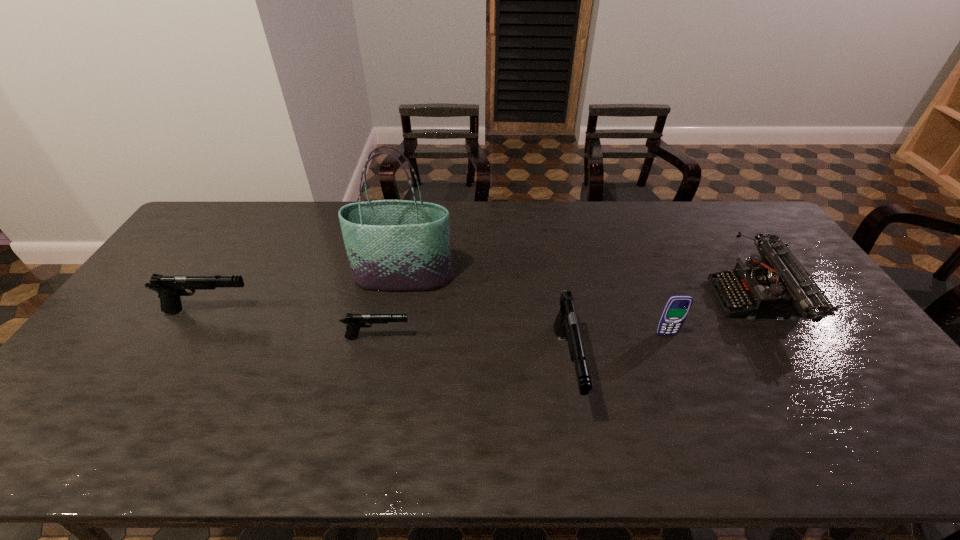
The height and width of the screenshot is (540, 960). Identify the location of vacant space in between the tote bag and the rightmost gun. (485, 322).

Image resolution: width=960 pixels, height=540 pixels. I want to click on free space between the rightmost object and the second tallest gun, so click(x=483, y=306).

Locate an element on the screen. This screenshot has width=960, height=540. vacant area between the tote bag and the fifth object from left to right is located at coordinates (535, 306).

You are a GUI agent. You are given a task and a screenshot of the screen. Output one action in this format:
    pyautogui.click(x=<x>, y=<y>)
    Task: Click on the vacant area between the tallest object and the cellular telephone
    The height and width of the screenshot is (540, 960).
    Given the screenshot: What is the action you would take?
    pos(535,306)

Where is `object that is the second closest one to the third object from right to left`? object that is the second closest one to the third object from right to left is located at coordinates (392, 245).

Select which object is the second closest to the second shortest gun. Please provide its 2D coordinates. Your answer should be formatted as a tuple, i.e. [(x, y)], where the tuple contains the x and y coordinates of a point satisfying the conditions above.

[(354, 322)]

At what (x,y) coordinates should I click in order to perform the action: click on gun identified as the second closest to the third object from right to left. Please return your answer as a coordinate pair (x, y). Looking at the image, I should click on (169, 287).

The image size is (960, 540). What are the coordinates of `the closest gun to the typewriter` in the screenshot? It's located at (566, 324).

I want to click on vacant space that satisfies the following two spatial constraints: 1. on the keyboard of the typewriter; 2. at the aiming end of the third object from right to left, so coord(798,367).

Identify the location of vacant region that satisfies the following two spatial constraints: 1. on the keyboard of the rightmost object; 2. on the front-facing side of the cellular telephone. click(x=777, y=334).